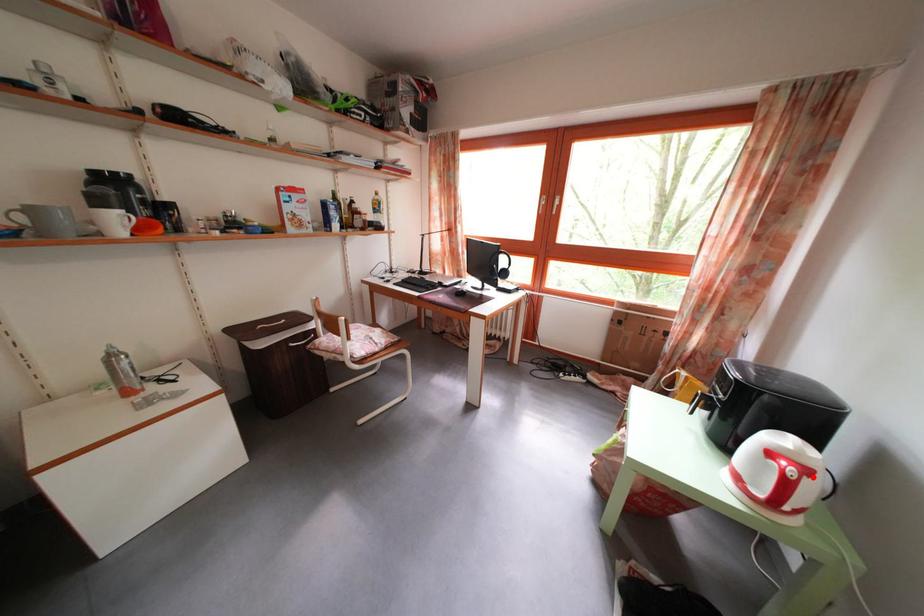
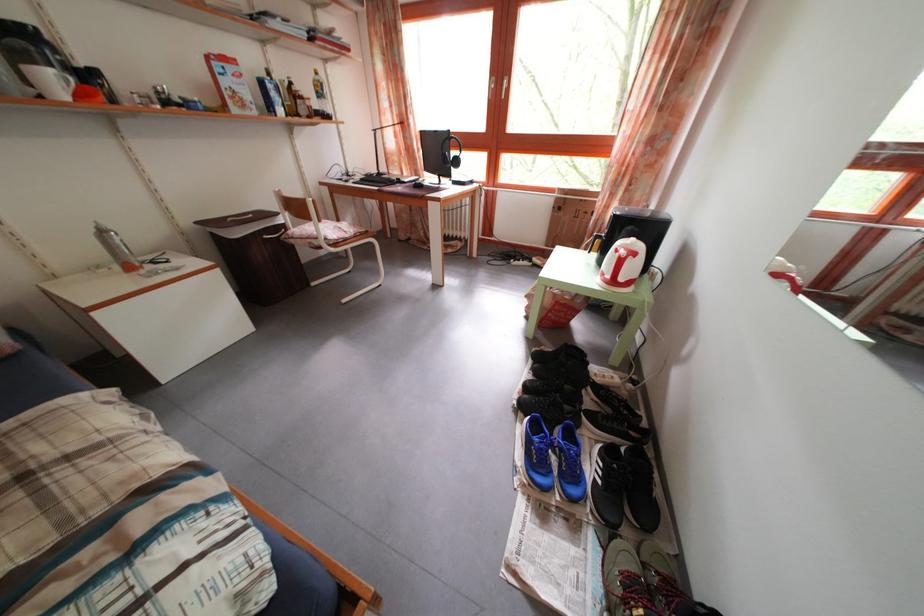
Question: I am providing you with two images of the same scene from different viewpoints. In image1, a red point is highlighted. Considering the same 3D point in image2, which of the following is correct?

Choices:
 (A) It is closer
 (B) It is farther

Answer: (B)